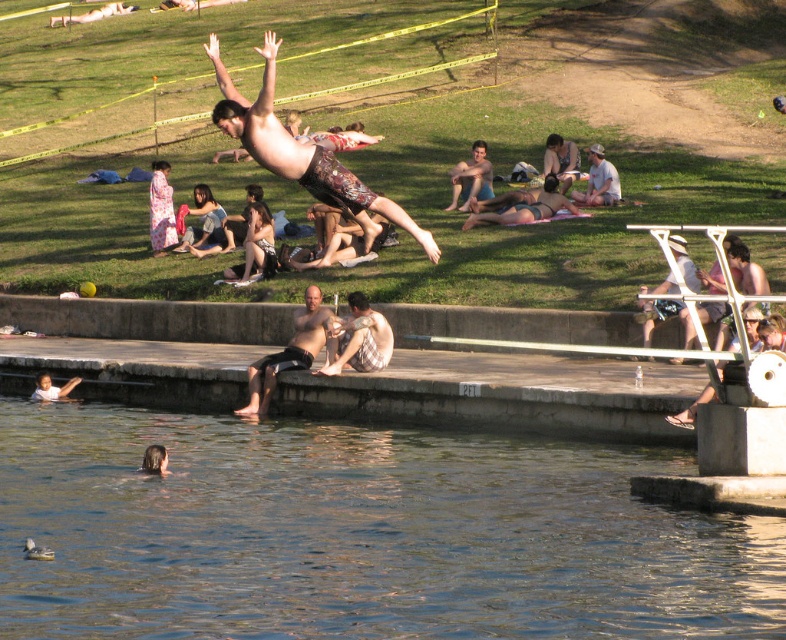
Measure the distance between point (362, 320) and camera.

Point (362, 320) and camera are 139.75 feet apart.

Is plaid fabric shirt at center taller than smooth skin child at lower left?

Yes, plaid fabric shirt at center is taller than smooth skin child at lower left.

The image size is (786, 640). Find the location of `plaid fabric shirt at center`. plaid fabric shirt at center is located at coordinates (358, 339).

Is point (263, 432) behind point (362, 362)?

Yes, point (263, 432) is farther from viewer.

Is point (715, 595) positioned before point (376, 314)?

Yes, point (715, 595) is closer to viewer.

Where is `clear water at lower left`? The image size is (786, 640). clear water at lower left is located at coordinates (358, 534).

Can you confirm if black matte shorts at center is wider than smooth skin child at lower left?

Correct, the width of black matte shorts at center exceeds that of smooth skin child at lower left.

Is point (270, 362) behind point (39, 397)?

No, (270, 362) is in front of (39, 397).

This screenshot has width=786, height=640. I want to click on black matte shorts at center, so click(289, 353).